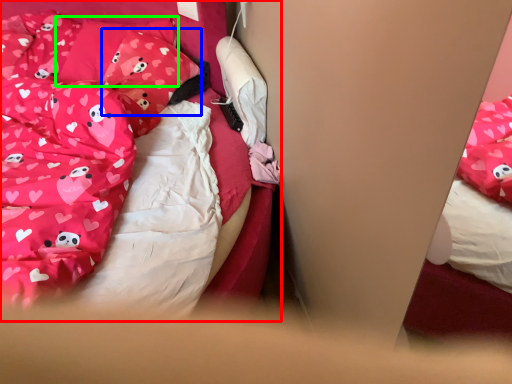
Question: Based on their relative distances, which object is nearer to bed (highlighted by a red box)? Choose from pillow (highlighted by a blue box) and pillow (highlighted by a green box).

Choices:
 (A) pillow
 (B) pillow

Answer: (A)